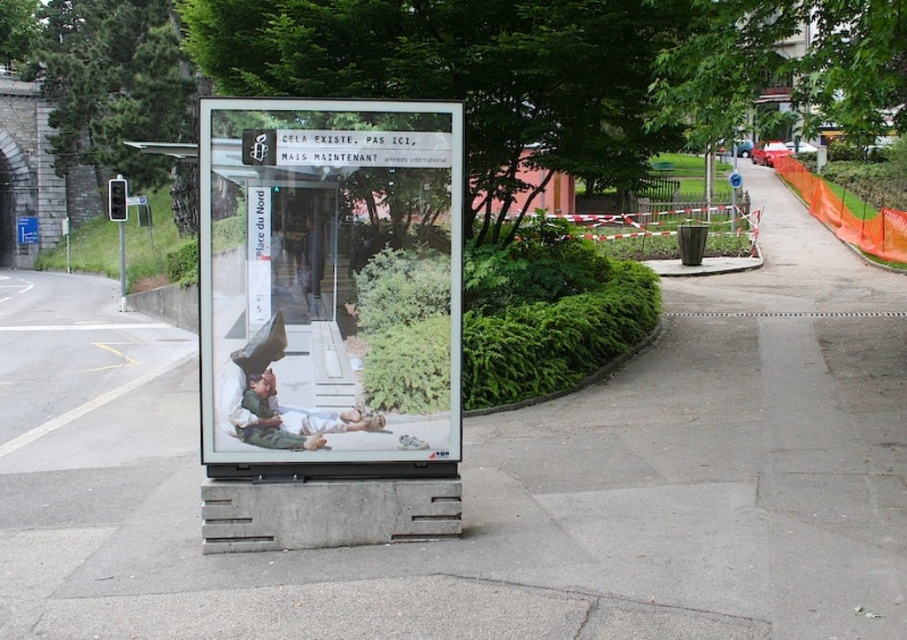
You are a delivery person carrying a package that is 1.2 meters wide. You need to pass through the space between the clear glass billboard at center and the white cotton shirt at center. Can your package fit through the space without touching either object?

The clear glass billboard at center might be wider than the white cotton shirt at center, but since the exact width difference is not specified, it is uncertain whether the 1.2 meter wide package can safely pass through the space between them without touching either object.

You are standing on the sidewalk in front of the billboard. You want to take a photo of the clear glass billboard at center without any obstructions. Where should you position yourself relative to the point marked by the coordinates point (329,321) to ensure the billboard is fully visible?

To take a photo of the clear glass billboard at center without obstructions, position yourself directly in front of the point marked by the coordinates point (329,321). This central point ensures the billboard is fully visible without any obstructions from surrounding structures or elements.

You are a city planner analyzing the placement of the clear glass billboard at center. Based on its coordinates, can you determine if it is positioned closer to the left edge or the right edge of the sidewalk?

The clear glass billboard at center is located at point 0.502 on the x and y axis, which is nearly the center point of the sidewalk, so it is equally distant from both edges.